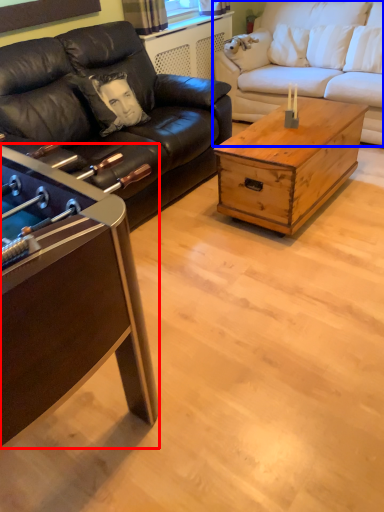
Question: Which of the following is the farthest to the observer, coffee table (highlighted by a red box) or studio couch (highlighted by a blue box)?

Choices:
 (A) coffee table
 (B) studio couch

Answer: (B)